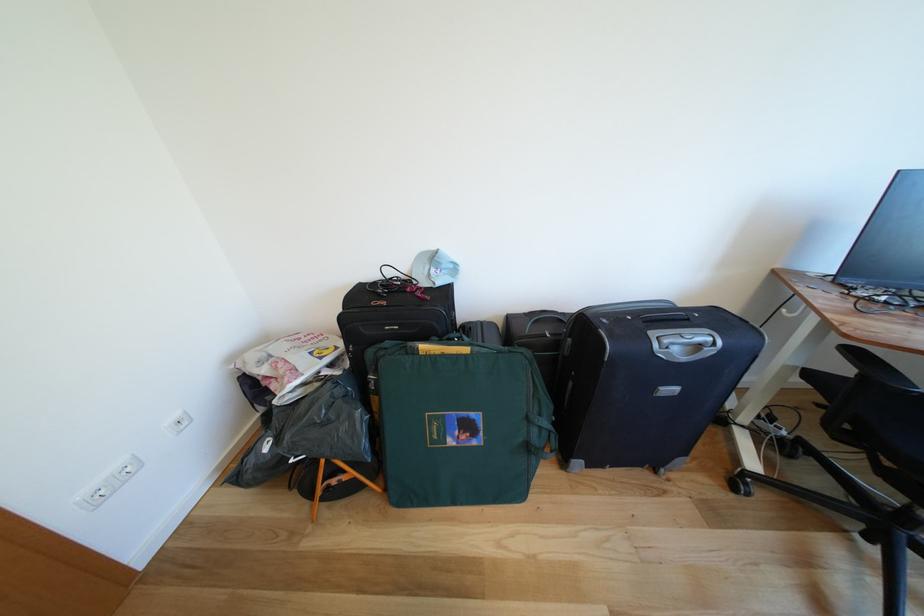
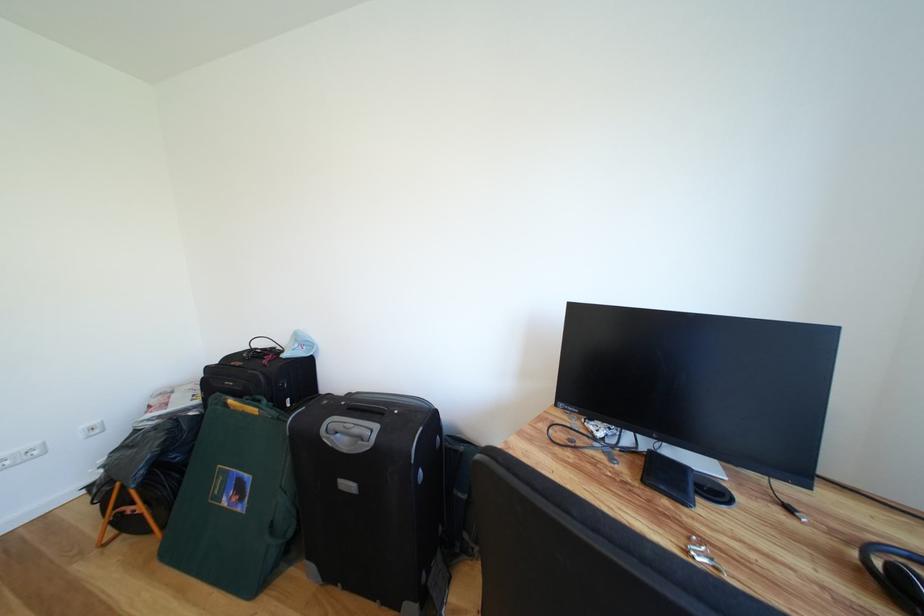
Locate, in the second image, the point that corresponds to the point at 459,447 in the first image.

(234, 506)